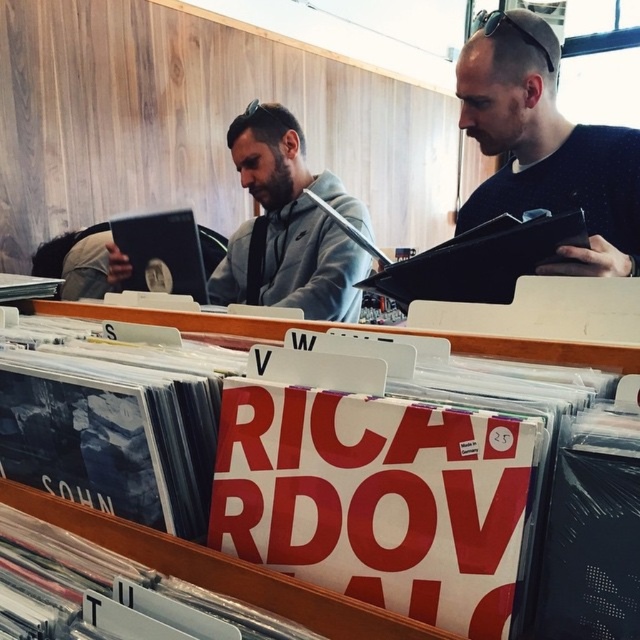
Question: Can you confirm if black matte book at upper right is positioned to the right of gray matte hoodie at center?

Choices:
 (A) no
 (B) yes

Answer: (B)

Question: Does white plastic record case at center appear over gray matte hoodie at center?

Choices:
 (A) yes
 (B) no

Answer: (B)

Question: Considering the real-world distances, which object is closest to the gray matte hoodie at center?

Choices:
 (A) white plastic record case at center
 (B) black matte book at upper right

Answer: (B)

Question: Among these objects, which one is nearest to the camera?

Choices:
 (A) white plastic record case at center
 (B) black matte book at upper right

Answer: (A)

Question: Which of the following is the farthest from the observer?

Choices:
 (A) (237, 253)
 (B) (435, 563)

Answer: (A)

Question: Is white plastic record case at center above gray matte hoodie at center?

Choices:
 (A) no
 (B) yes

Answer: (A)